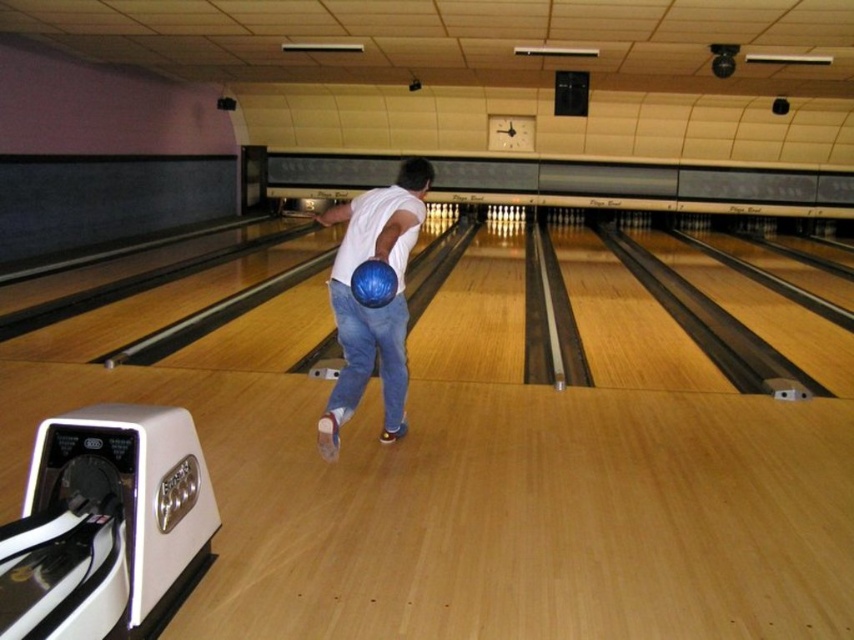
You are a bowling ball inspector checking the alignment of the blue matte bowling ball at center and the blue rubber bowling ball at center. Which one is positioned lower?

The blue matte bowling ball at center is positioned lower than the blue rubber bowling ball at center according to the description.

You are a photographer capturing the action at the bowling alley. You need to position yourself so that you can clearly see both the blue denim jeans at center and the blue rubber bowling ball at center. Based on their positions, which object should you focus on first to ensure both are in frame?

You should focus on the blue denim jeans at center first since it is to the left of the blue rubber bowling ball at center, ensuring both remain in the frame as you adjust your camera.